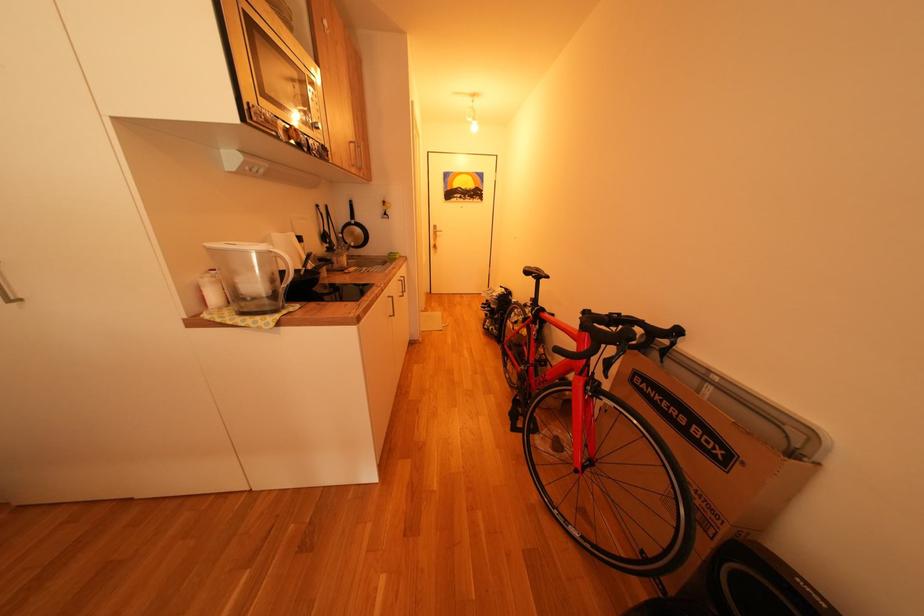
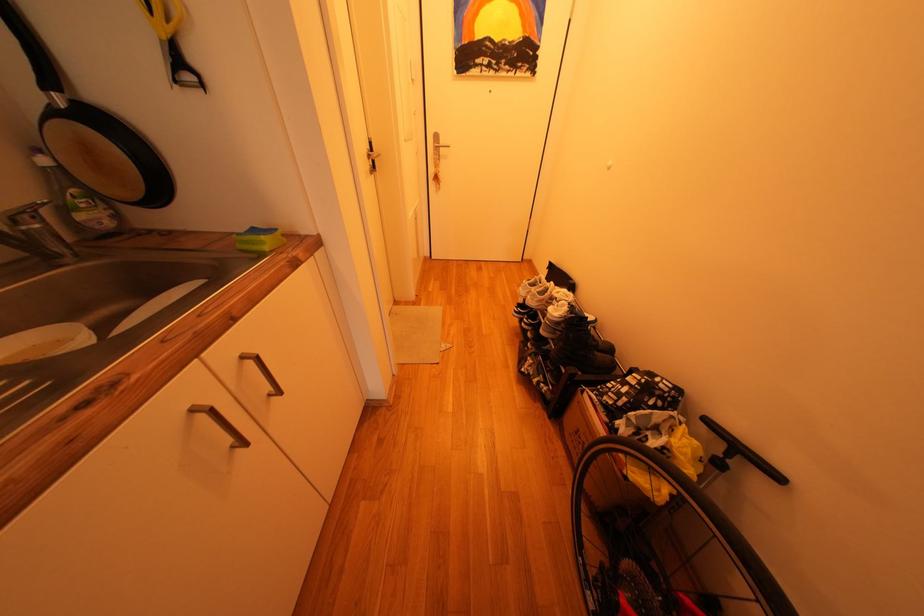
Question: Which direction would the cameraman need to move to produce the second image? Reply with the corresponding letter.

Choices:
 (A) Left
 (B) Right
 (C) Forward
 (D) Backward

Answer: (C)